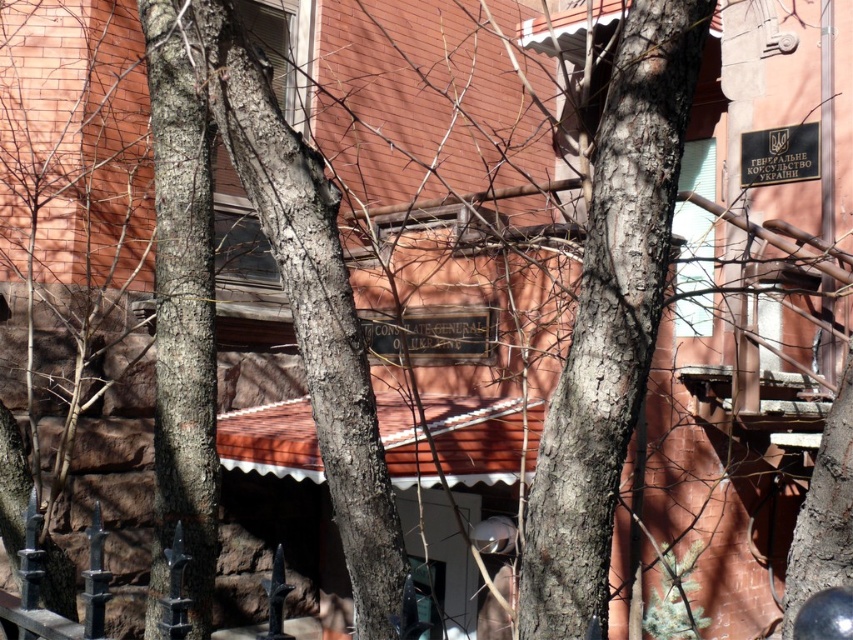
Which is more to the right, black wood sign at center or black metal sign at upper right?

Positioned to the right is black metal sign at upper right.

Does black wood sign at center have a larger size compared to black metal sign at upper right?

Yes, black wood sign at center is bigger than black metal sign at upper right.

Where is `black wood sign at center`? This screenshot has height=640, width=853. black wood sign at center is located at coordinates (428, 332).

Who is higher up, smooth bark tree at center or black metal sign at upper right?

Positioned higher is black metal sign at upper right.

Is smooth bark tree at center positioned in front of black metal sign at upper right?

Yes, smooth bark tree at center is closer to the viewer.

Is point (625, 246) in front of point (799, 125)?

Yes, it is.

The height and width of the screenshot is (640, 853). I want to click on smooth bark tree at center, so click(610, 317).

Is smooth bark tree at center wider than black wood sign at center?

In fact, smooth bark tree at center might be narrower than black wood sign at center.

Is point (637, 358) farther from camera compared to point (485, 323)?

No.

Is point (664, 122) farther from viewer compared to point (439, 321)?

No, (664, 122) is in front of (439, 321).

Where is `smooth bark tree at center`? This screenshot has height=640, width=853. smooth bark tree at center is located at coordinates (610, 317).